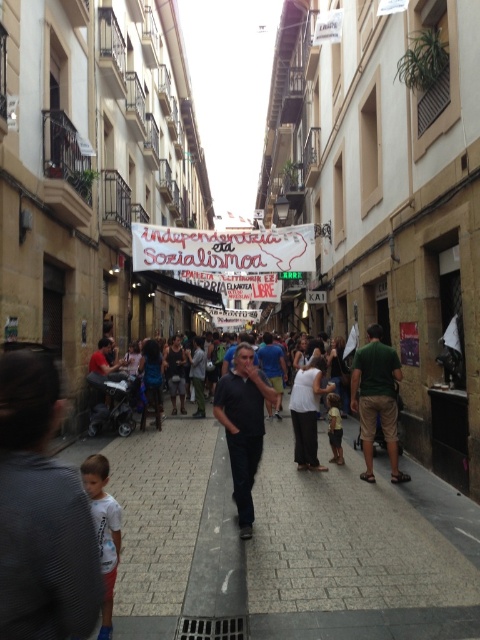
You are a tourist standing on the cobblestone street in the European city scene. You notice the white paper banner at center and the green fabric shirt at right. Which object is taller when viewed from your perspective?

The green fabric shirt at right is taller than the white paper banner at center.

You are a tourist walking down the street and want to take a photo of both the white paper banner at center and the green fabric shirt at right. Since you can only take one photo, which object should you aim the camera at to capture both in the frame?

You should aim the camera at the white paper banner at center because it is positioned on the left side of the green fabric shirt at right, so both will be visible in the frame when centered on the banner.

From the picture: You are a tourist walking down the street and want to take a photo of both the green fabric shirt at right and the white cotton shirt at lower left. Which shirt should you focus on first to ensure both are in the frame?

You should focus on the green fabric shirt at right first because it is closer to you than the white cotton shirt at lower left, so adjusting the camera to include both would require ensuring the closer object is centered before framing the farther one.